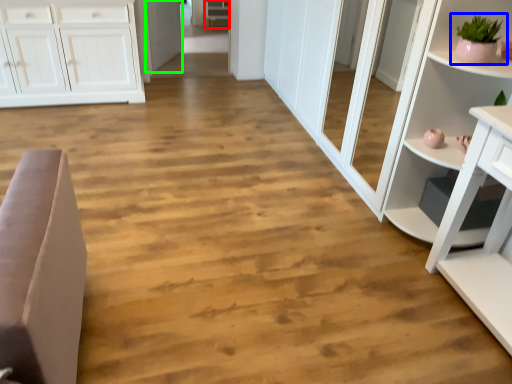
Question: Estimate the real-world distances between objects in this image. Which object is closer to cabinetry (highlighted by a red box), houseplant (highlighted by a blue box) or door (highlighted by a green box)?

Choices:
 (A) houseplant
 (B) door

Answer: (B)